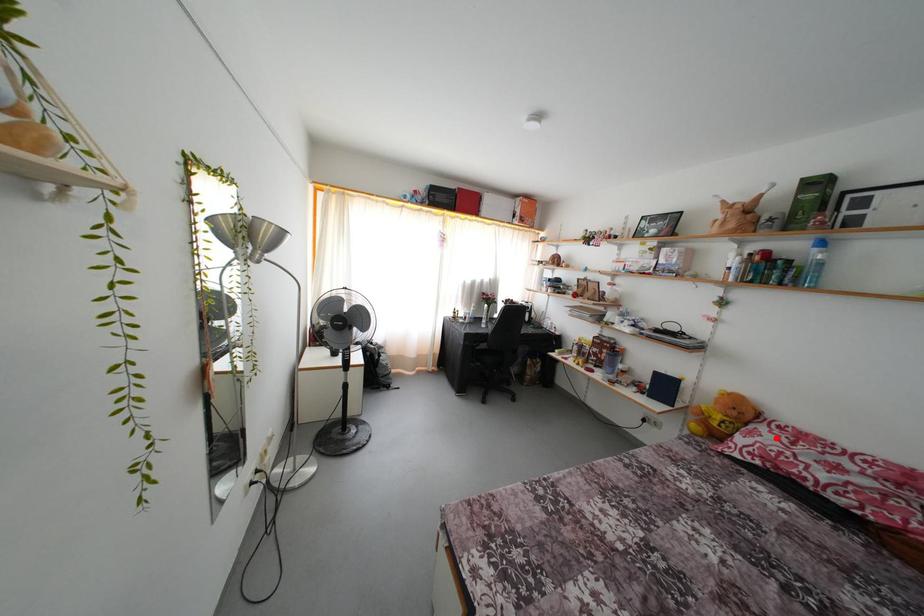
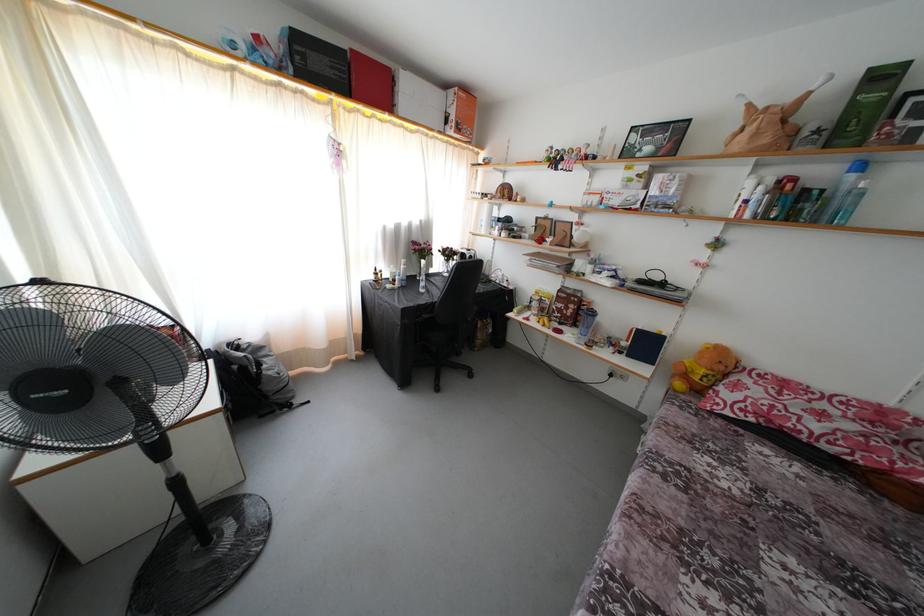
In the second image, find the point that corresponds to the highlighted location in the first image.

(760, 389)